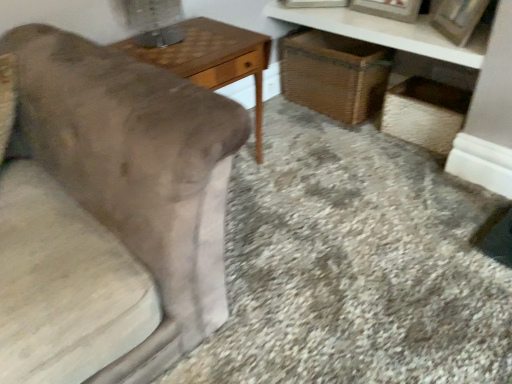
Question: From the image's perspective, is woven straw basket at lower right positioned above or below wooden picture frame at upper right?

Choices:
 (A) below
 (B) above

Answer: (A)

Question: Does point (416, 104) appear closer or farther from the camera than point (458, 23)?

Choices:
 (A) farther
 (B) closer

Answer: (A)

Question: Which object is the farthest from the metallic silver table lamp at upper left?

Choices:
 (A) woven straw basket at lower right
 (B) brown wicker basket at center
 (C) wooden picture frame at upper right
 (D) woven wicker vanity at upper right
 (E) woodenobject at left

Answer: (C)

Question: Which is nearer to the woodenobject at left?

Choices:
 (A) woven straw basket at lower right
 (B) wooden picture frame at upper right
 (C) metallic silver table lamp at upper left
 (D) woven wicker vanity at upper right
 (E) brown wicker basket at center

Answer: (C)